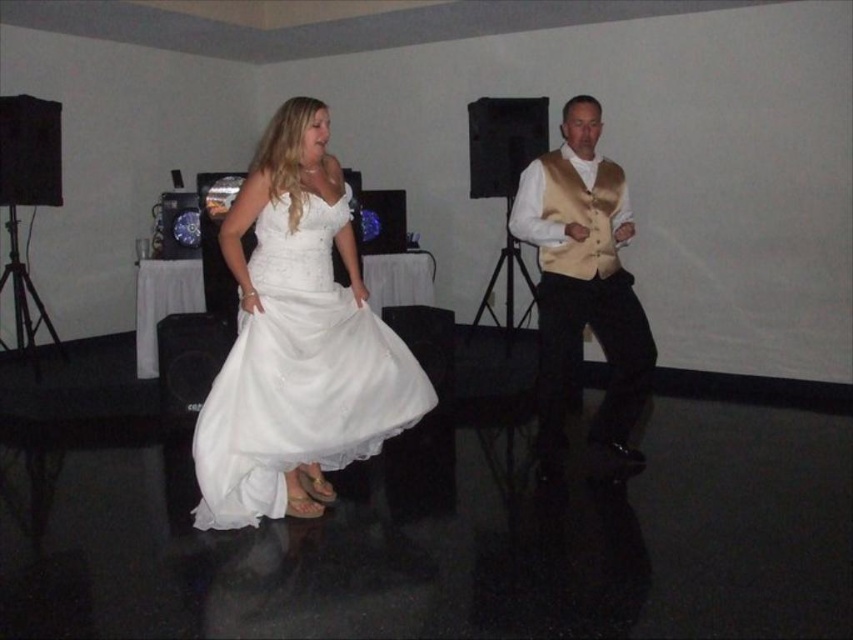
Can you confirm if white satin dress at center is wider than shiny gold vest at center?

Indeed, white satin dress at center has a greater width compared to shiny gold vest at center.

Looking at this image, who is more forward, (335, 330) or (531, 193)?

Point (335, 330) is more forward.

You are a GUI agent. You are given a task and a screenshot of the screen. Output one action in this format:
    pyautogui.click(x=<x>, y=<y>)
    Task: Click on the white satin dress at center
    The width and height of the screenshot is (853, 640).
    Given the screenshot: What is the action you would take?
    pyautogui.click(x=299, y=374)